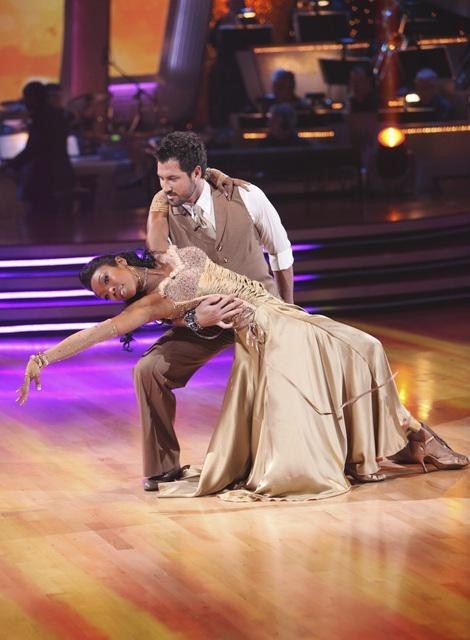
Where is `dance floor`? Image resolution: width=470 pixels, height=640 pixels. dance floor is located at coordinates (194, 562).